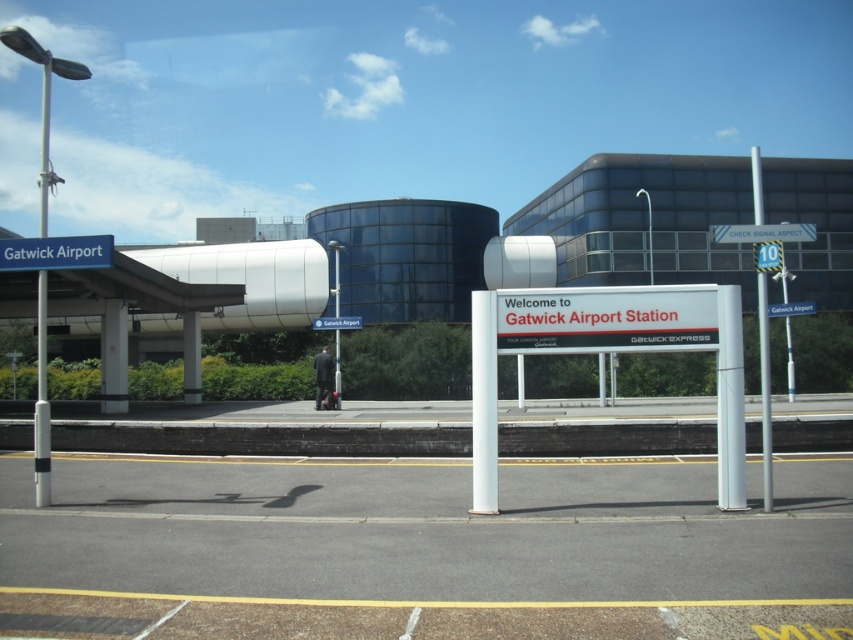
Between white plastic sign at upper right and blue plastic sign at upper center, which one has less height?

blue plastic sign at upper center

Image resolution: width=853 pixels, height=640 pixels. What do you see at coordinates (763, 232) in the screenshot? I see `white plastic sign at upper right` at bounding box center [763, 232].

Image resolution: width=853 pixels, height=640 pixels. I want to click on white plastic sign at upper right, so click(763, 232).

Is white metallic pole at center taller than white glossy pillar at center?

Indeed, white metallic pole at center has a greater height compared to white glossy pillar at center.

Does white metallic pole at center have a greater width compared to white glossy pillar at center?

Yes, white metallic pole at center is wider than white glossy pillar at center.

Does point (769, 352) come in front of point (190, 396)?

Yes, point (769, 352) is closer to viewer.

Identify the location of white metallic pole at center. The image size is (853, 640). (764, 390).

Does metallic pole at left appear under white glossy pillar at center?

Incorrect, metallic pole at left is not positioned below white glossy pillar at center.

Is point (41, 109) positioned after point (190, 360)?

Yes, point (41, 109) is behind point (190, 360).

The height and width of the screenshot is (640, 853). What are the coordinates of `metallic pole at left` in the screenshot? It's located at (41, 401).